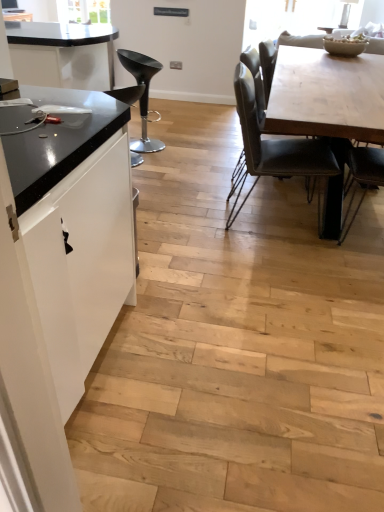
This screenshot has height=512, width=384. What are the coordinates of `empty space that is ontop of white matte cabinet at left (from a real-world perspective)` in the screenshot? It's located at (46, 116).